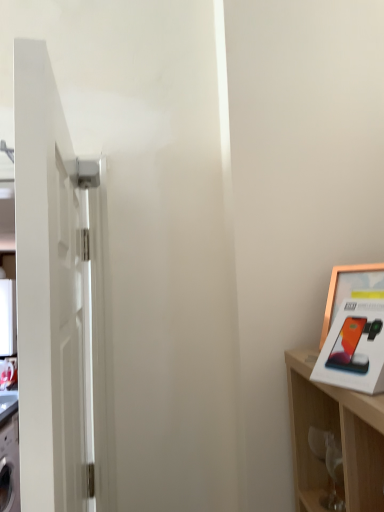
Question: Does point (336, 303) appear closer or farther from the camera than point (51, 374)?

Choices:
 (A) closer
 (B) farther

Answer: (B)

Question: In terms of height, does gold metallic picture frame at upper right look taller or shorter compared to white glossy door at left?

Choices:
 (A) short
 (B) tall

Answer: (A)

Question: In terms of size, does gold metallic picture frame at upper right appear bigger or smaller than white glossy door at left?

Choices:
 (A) small
 (B) big

Answer: (A)

Question: Which is correct: white glossy door at left is inside gold metallic picture frame at upper right, or outside of it?

Choices:
 (A) inside
 (B) outside

Answer: (B)

Question: Is white glossy door at left bigger or smaller than gold metallic picture frame at upper right?

Choices:
 (A) big
 (B) small

Answer: (A)

Question: From the image's perspective, relative to gold metallic picture frame at upper right, is white glossy door at left above or below?

Choices:
 (A) below
 (B) above

Answer: (A)

Question: From a real-world perspective, relative to gold metallic picture frame at upper right, is white glossy door at left vertically above or below?

Choices:
 (A) below
 (B) above

Answer: (A)